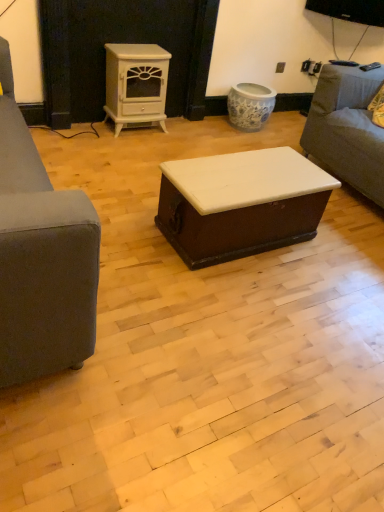
Find the location of a particular element. free location to the right of white glossy wood stove at upper center is located at coordinates (182, 133).